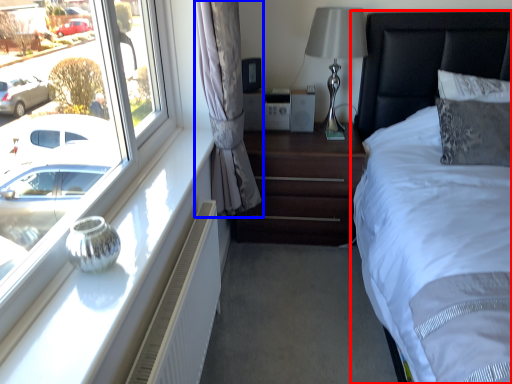
Question: Which object appears farthest to the camera in this image, bed (highlighted by a red box) or curtain (highlighted by a blue box)?

Choices:
 (A) bed
 (B) curtain

Answer: (B)